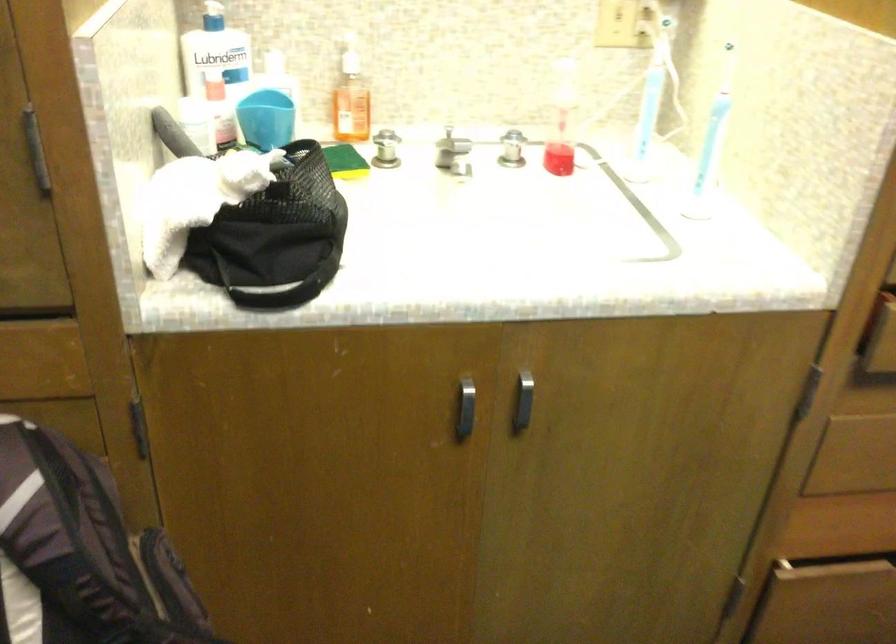
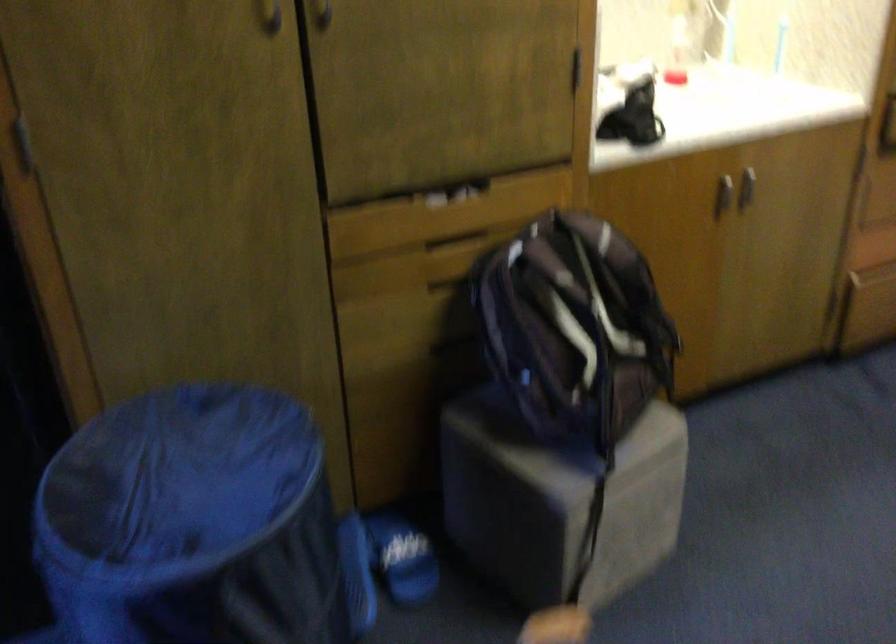
Question: I am providing you with two images of the same scene from different viewpoints. Please identify which objects are invisible in image2.

Choices:
 (A) blue plastic cup
 (B) blue VR headset
 (C) blue laundry hamper
 (D) blue slide sandal

Answer: (A)